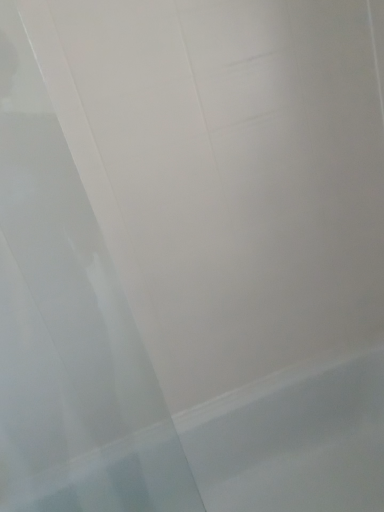
This screenshot has width=384, height=512. I want to click on white glossy bathtub at lower right, so click(249, 452).

What do you see at coordinates (249, 452) in the screenshot? I see `white glossy bathtub at lower right` at bounding box center [249, 452].

Where is `white glossy bathtub at lower right`? The image size is (384, 512). white glossy bathtub at lower right is located at coordinates (249, 452).